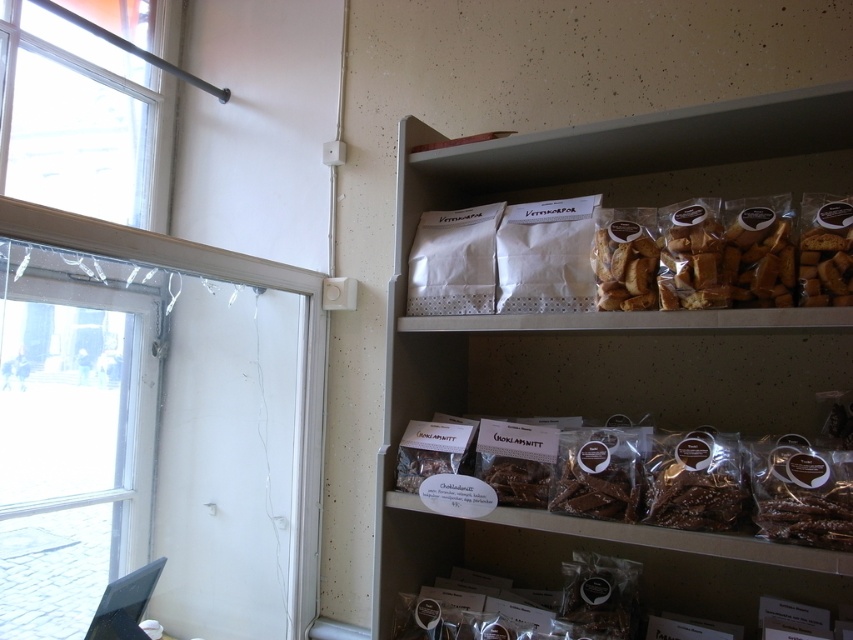
Can you confirm if clear glass window at left is thinner than brown textured chocolate at center?

Indeed, clear glass window at left has a lesser width compared to brown textured chocolate at center.

Which is in front, point (76, 356) or point (664, 506)?

Point (664, 506)

Describe the element at coordinates (73, 438) in the screenshot. The width and height of the screenshot is (853, 640). I see `clear glass window at left` at that location.

Locate an element on the screen. This screenshot has width=853, height=640. clear glass window at left is located at coordinates (73, 438).

Which is below, clear glass window at upper left or brown textured chocolate at center?

brown textured chocolate at center is below.

Is point (59, 118) in front of point (639, 524)?

No, it is not.

You are a GUI agent. You are given a task and a screenshot of the screen. Output one action in this format:
    pyautogui.click(x=<x>, y=<y>)
    Task: Click on the clear glass window at upper left
    The width and height of the screenshot is (853, 640).
    Given the screenshot: What is the action you would take?
    pyautogui.click(x=80, y=122)

Can you confirm if brown textured chocolate at center is shorter than golden brown paper at upper right?

Yes, brown textured chocolate at center is shorter than golden brown paper at upper right.

Who is more distant from viewer, (724, 500) or (642, 294)?

The point (642, 294) is more distant.

Identify the location of brown textured chocolate at center. (723, 524).